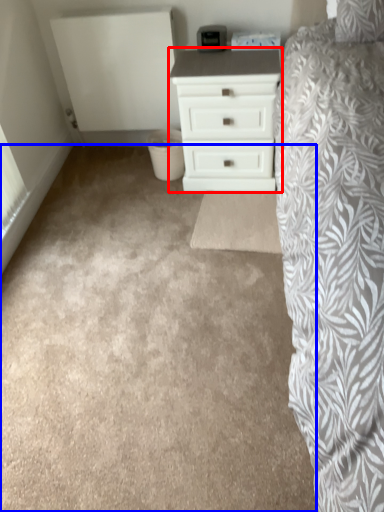
Question: Which object appears closest to the camera in this image, chest of drawers (highlighted by a red box) or plain (highlighted by a blue box)?

Choices:
 (A) chest of drawers
 (B) plain

Answer: (B)